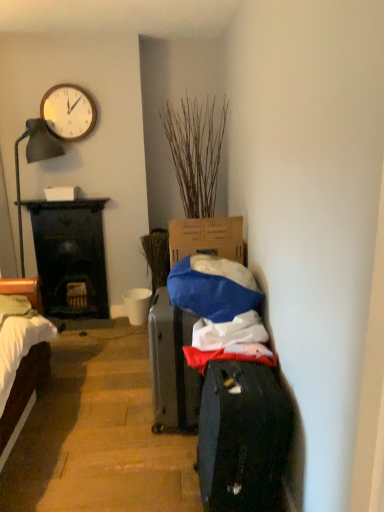
Describe the element at coordinates (68, 112) in the screenshot. I see `wooden clock at upper left` at that location.

Locate an element on the screen. dark gray fabric suitcase at center is located at coordinates (243, 438).

The width and height of the screenshot is (384, 512). What do you see at coordinates (137, 305) in the screenshot?
I see `white matte bucket at center` at bounding box center [137, 305].

You are a GUI agent. You are given a task and a screenshot of the screen. Output one action in this format:
    pyautogui.click(x=<x>, y=<y>)
    Task: Click on the dry grass at center
    
    Given the screenshot: What is the action you would take?
    pyautogui.click(x=195, y=151)

Consider the image. Is dry grass at center placed right next to white matte bucket at center?

No.

What's the angular difference between dry grass at center and white matte bucket at center's facing directions?

dry grass at center and white matte bucket at center are facing 0.229 degrees away from each other.

You are a GUI agent. You are given a task and a screenshot of the screen. Output one action in this format:
    pyautogui.click(x=<x>, y=<y>)
    Task: Click on the bucket that is behind the dry grass at center
    
    Given the screenshot: What is the action you would take?
    pyautogui.click(x=137, y=305)

Is dry grass at center outside of white matte bucket at center?

Yes, dry grass at center is outside of white matte bucket at center.

From the image's perspective, between wooden clock at upper left and dark gray fabric suitcase at center, who is located below?

From the image's view, dark gray fabric suitcase at center is below.

Between wooden clock at upper left and dark gray fabric suitcase at center, which one appears on the right side from the viewer's perspective?

Positioned to the right is dark gray fabric suitcase at center.

Between point (76, 138) and point (223, 471), which one is positioned behind?

The point (76, 138) is more distant.

From a real-world perspective, is wooden clock at upper left beneath dark gray fabric suitcase at center?

No, from a real-world perspective, wooden clock at upper left is not beneath dark gray fabric suitcase at center.

Considering the sizes of white matte bucket at center and dry grass at center in the image, is white matte bucket at center wider or thinner than dry grass at center?

In the image, white matte bucket at center appears to be more narrow than dry grass at center.

Is point (151, 293) closer or farther from the camera than point (186, 115)?

Clearly, point (151, 293) is more distant from the camera than point (186, 115).

Are white matte bucket at center and dry grass at center beside each other?

No, white matte bucket at center is not with dry grass at center.

Does white matte bucket at center appear on the right side of dry grass at center?

No.

In the scene shown: Could dark wood desk at left be considered to be inside white matte bucket at center?

No, dark wood desk at left is not surrounded by white matte bucket at center.

Who is shorter, white matte bucket at center or dark wood desk at left?

With less height is white matte bucket at center.

Considering the sizes of objects white matte bucket at center and dark wood desk at left in the image provided, who is thinner, white matte bucket at center or dark wood desk at left?

dark wood desk at left is thinner.

Where is `bucket on the right of dark wood desk at left`? bucket on the right of dark wood desk at left is located at coordinates (137, 305).

From a real-world perspective, does dark wood desk at left sit lower than dry grass at center?

Yes, from a real-world perspective, dark wood desk at left is under dry grass at center.

Can you tell me how much dark wood desk at left and dry grass at center differ in facing direction?

dark wood desk at left and dry grass at center are facing 0.74 degrees away from each other.

Find the location of a particular element. plant above the dark wood desk at left (from the image's perspective) is located at coordinates (195, 151).

Considering the sizes of objects dark wood desk at left and dry grass at center in the image provided, who is thinner, dark wood desk at left or dry grass at center?

Thinner between the two is dark wood desk at left.

Is dark wood desk at left directly adjacent to white matte bucket at center?

dark wood desk at left and white matte bucket at center are clearly separated.

Consider the image. Considering the relative sizes of dark wood desk at left and white matte bucket at center in the image provided, is dark wood desk at left smaller than white matte bucket at center?

Incorrect, dark wood desk at left is not smaller in size than white matte bucket at center.

Can you confirm if dark wood desk at left is wider than white matte bucket at center?

No.

Considering the sizes of dark wood desk at left and white matte bucket at center in the image, is dark wood desk at left taller or shorter than white matte bucket at center?

dark wood desk at left is taller than white matte bucket at center.

Does dark wood desk at left have a lesser height compared to wooden clock at upper left?

No.

Is dark wood desk at left next to wooden clock at upper left and touching it?

dark wood desk at left is not next to wooden clock at upper left, and they're not touching.

Does dark wood desk at left contain wooden clock at upper left?

No.

Which point is more distant from viewer, [50,228] or [78,139]?

Point [50,228]

Where is `bucket lying on the left of dry grass at center`? bucket lying on the left of dry grass at center is located at coordinates 137,305.

At what (x,y) coordinates should I click in order to perform the action: click on luggage and bags lying in front of the wooden clock at upper left. Please return your answer as a coordinate pair (x, y). The height and width of the screenshot is (512, 384). Looking at the image, I should click on (243, 438).

Estimate the real-world distances between objects in this image. Which object is closer to dark gray fabric suitcase at center, dry grass at center or dark wood desk at left?

dry grass at center is positioned closer to the anchor dark gray fabric suitcase at center.

Looking at the image, which one is located further to white matte bucket at center, dry grass at center or dark gray fabric suitcase at center?

dark gray fabric suitcase at center is positioned further to the anchor white matte bucket at center.

When comparing their distances from white matte bucket at center, does dark wood desk at left or wooden clock at upper left seem further?

Based on the image, wooden clock at upper left appears to be further to white matte bucket at center.

When comparing their distances from dark gray fabric suitcase at center, does wooden clock at upper left or dark wood desk at left seem closer?

The object closer to dark gray fabric suitcase at center is dark wood desk at left.

Based on their spatial positions, is dark wood desk at left or wooden clock at upper left closer to dry grass at center?

Among the two, wooden clock at upper left is located nearer to dry grass at center.

Looking at the image, which one is located closer to dry grass at center, dark wood desk at left or white matte bucket at center?

dark wood desk at left is positioned closer to the anchor dry grass at center.

Estimate the real-world distances between objects in this image. Which object is further from dark wood desk at left, wooden clock at upper left or white matte bucket at center?

The object further to dark wood desk at left is wooden clock at upper left.

Looking at the image, which one is located further to dark wood desk at left, dark gray fabric suitcase at center or white matte bucket at center?

Among the two, dark gray fabric suitcase at center is located further to dark wood desk at left.

The image size is (384, 512). I want to click on desk between wooden clock at upper left and white matte bucket at center in the up-down direction, so click(70, 254).

Find the location of a particular element. Image resolution: width=384 pixels, height=512 pixels. plant between wooden clock at upper left and white matte bucket at center in the vertical direction is located at coordinates 195,151.

At what (x,y) coordinates should I click in order to perform the action: click on plant between dark gray fabric suitcase at center and white matte bucket at center from front to back. Please return your answer as a coordinate pair (x, y). Looking at the image, I should click on (195, 151).

What are the coordinates of `clock positioned between dark gray fabric suitcase at center and dark wood desk at left from near to far` in the screenshot? It's located at (68, 112).